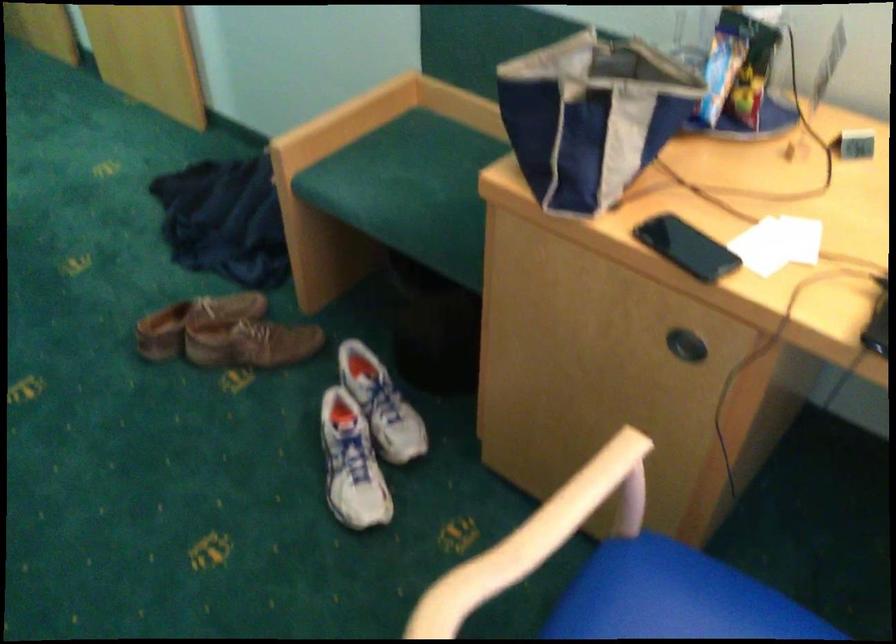
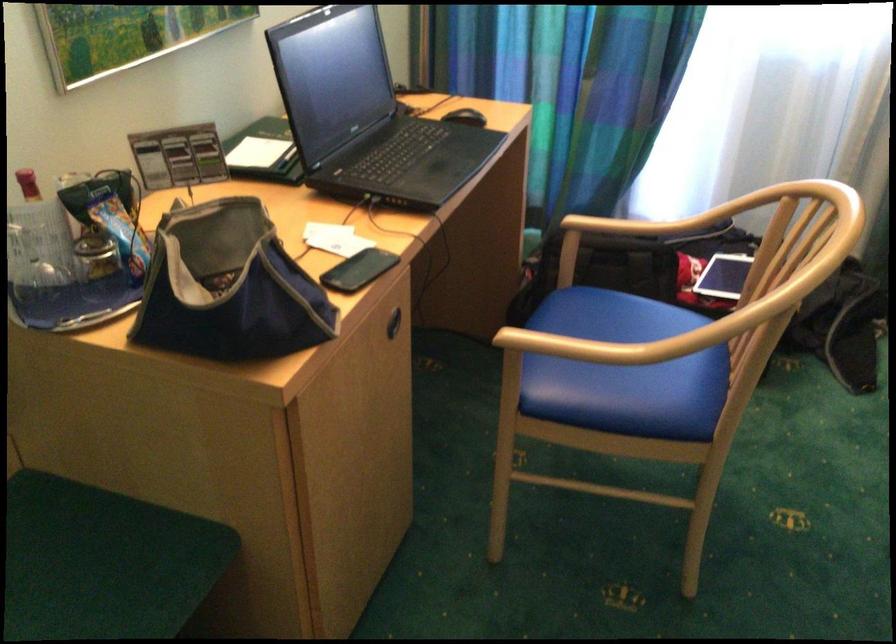
Where in the second image is the point corresponding to point (554, 532) from the first image?

(608, 346)